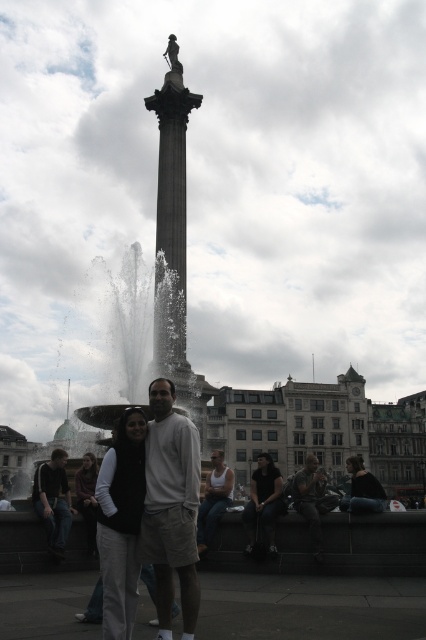
You are a photographer trying to capture both dark brown leather jacket at lower left and dark brown leather jacket at lower right in a single frame. Which jacket should you position closer to the left side of your camera viewfinder to include both?

To include both jackets in the frame, position the dark brown leather jacket at lower left closer to the left side of the camera viewfinder since it is already to the left of the dark brown leather jacket at lower right.

You are a photographer standing at the center of the plaza, aiming to capture both the dark brown leather jacket at lower left and the dark brown leather jacket at lower right in a single frame. Given that your camera has a maximum horizontal field of view of 60 degrees, can you determine if both jackets will fit within the frame?

The dark brown leather jacket at lower left and dark brown leather jacket at lower right are 89.46 feet apart from each other. To determine if they fit within a 60 degree field of view, we calculate the distance from the photographer to the jackets. Assuming the photographer is equidistant from both jackets, the minimum distance required for the 89.46 feet separation to fit within 60 degrees is approximately 89.46 feet divided by the tangent of 30 degrees. This results in a minimum distance of about 154.856